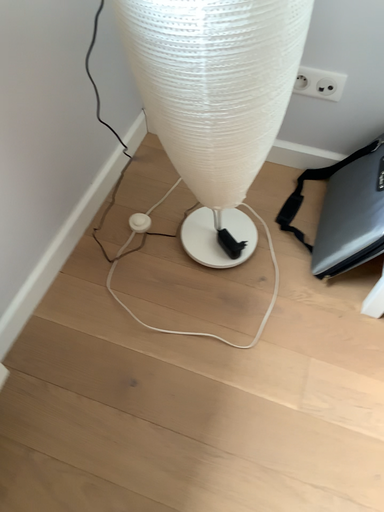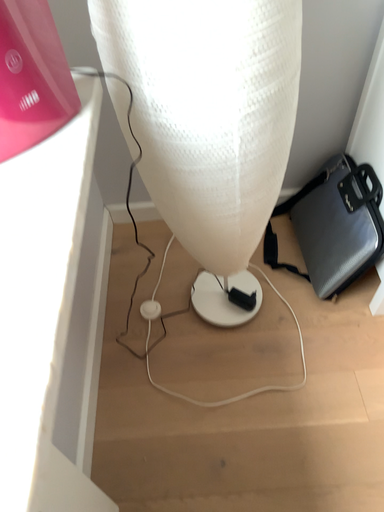
Question: How did the camera likely rotate when shooting the video?

Choices:
 (A) rotated downward
 (B) rotated upward

Answer: (B)